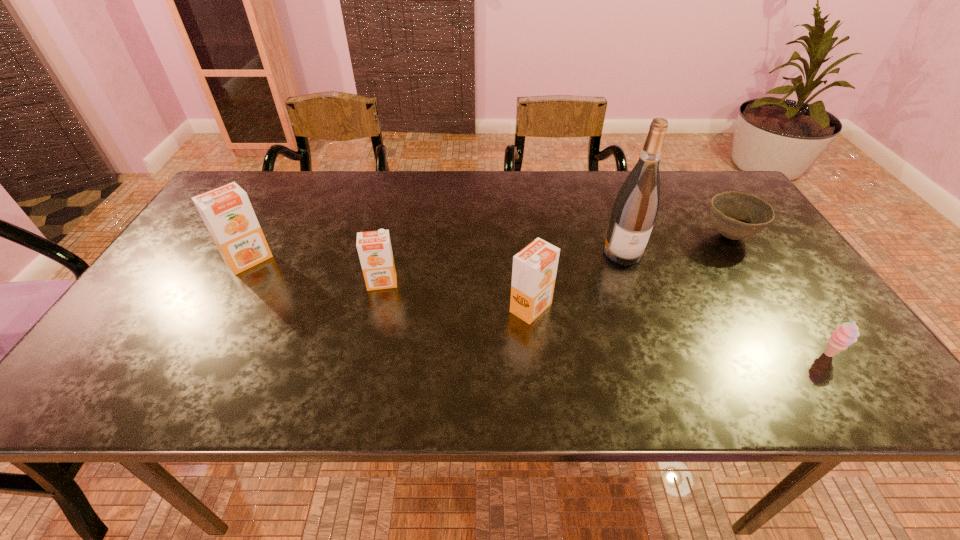
Find the location of a particular element. free area in between the wine bottle and the bowl is located at coordinates (676, 245).

Locate an element on the screen. unoccupied position between the shortest orange juice and the nearest object is located at coordinates (605, 319).

Locate an element on the screen. free area in between the tallest object and the nearest object is located at coordinates (726, 303).

You are a GUI agent. You are given a task and a screenshot of the screen. Output one action in this format:
    pyautogui.click(x=<x>, y=<y>)
    Task: Click on the object that is the second closest to the second orange juice from left to right
    This screenshot has height=540, width=960.
    Given the screenshot: What is the action you would take?
    pyautogui.click(x=534, y=270)

This screenshot has width=960, height=540. I want to click on object that is the third closest to the third object from right to left, so click(844, 335).

The width and height of the screenshot is (960, 540). Find the location of `orange juice that is the nearest to the second orange juice from right to left`. orange juice that is the nearest to the second orange juice from right to left is located at coordinates (227, 212).

Identify the location of orange juice that is the second closest to the leftmost orange juice. The width and height of the screenshot is (960, 540). (534, 270).

Locate an element on the screen. vacant position in the image that satisfies the following two spatial constraints: 1. on the front side of the leftmost object; 2. on the right side of the nearest orange juice is located at coordinates click(x=222, y=308).

Where is `free spot that satisfies the following two spatial constraints: 1. on the label of the sherbert; 2. on the right side of the third object from right to left`? Image resolution: width=960 pixels, height=540 pixels. free spot that satisfies the following two spatial constraints: 1. on the label of the sherbert; 2. on the right side of the third object from right to left is located at coordinates click(x=659, y=355).

The height and width of the screenshot is (540, 960). Find the location of `free space that satisfies the following two spatial constraints: 1. on the label of the sherbert; 2. on the right side of the third object from right to left`. free space that satisfies the following two spatial constraints: 1. on the label of the sherbert; 2. on the right side of the third object from right to left is located at coordinates (659, 355).